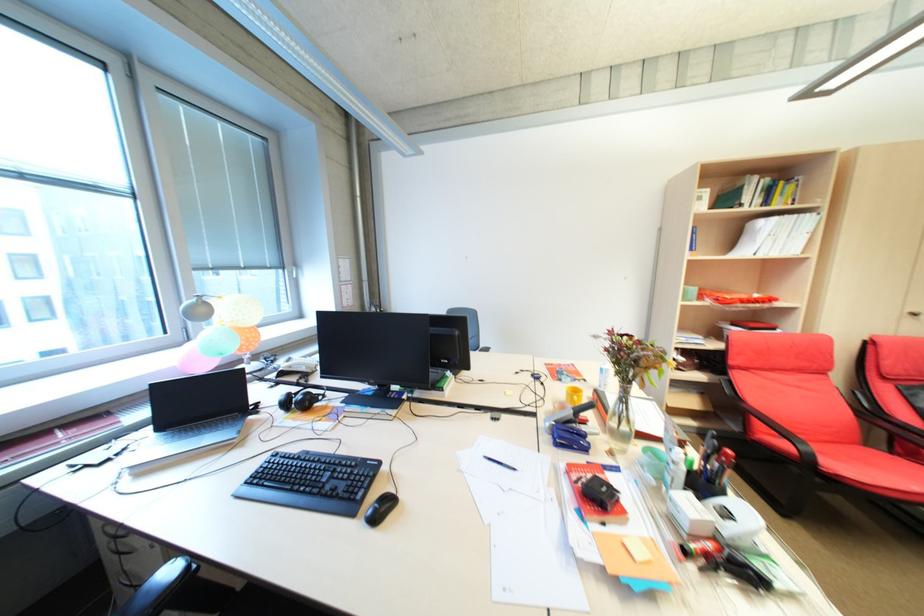
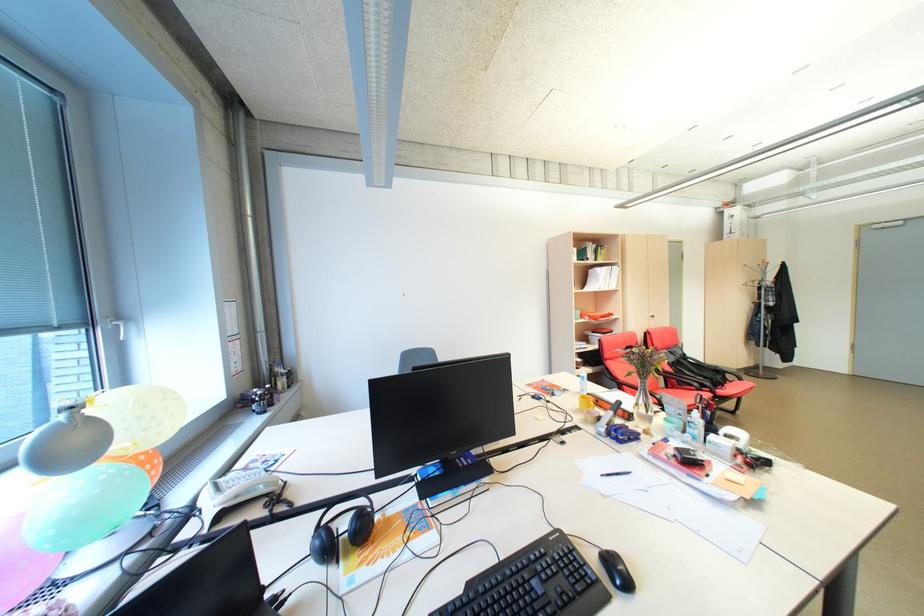
In the second image, find the point that corresponds to pixel 681 442 in the first image.

(688, 410)